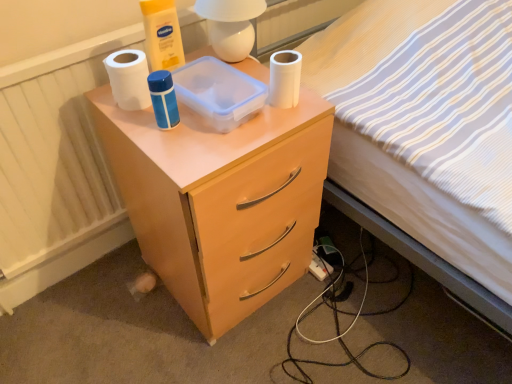
Question: From the image's perspective, relative to white glossy lamp at upper center, is transparent plastic container at upper center above or below?

Choices:
 (A) below
 (B) above

Answer: (A)

Question: From their relative heights in the image, would you say transparent plastic container at upper center is taller or shorter than white glossy lamp at upper center?

Choices:
 (A) tall
 (B) short

Answer: (B)

Question: Estimate the real-world distances between objects in this image. Which object is farther from the white striped fabric at upper right?

Choices:
 (A) transparent plastic container at upper center
 (B) white glossy lamp at upper center
 (C) matte wood nightstand at center
 (D) white matte toilet paper at upper left, acting as the first toilet paper starting from the left
 (E) white plastic power outlet at lower right

Answer: (D)

Question: Which object is positioned closest to the white striped fabric at upper right?

Choices:
 (A) white matte toilet paper at upper center, which appears as the 2th toilet paper when viewed from the left
 (B) transparent plastic container at upper center
 (C) white glossy lamp at upper center
 (D) white plastic power outlet at lower right
 (E) white matte toilet paper at upper left, acting as the first toilet paper starting from the left

Answer: (A)